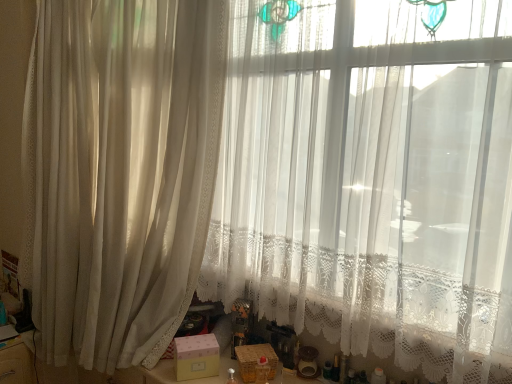
Question: From a real-world perspective, is pink matte box at center, the 2th box when ordered from right to left, located beneath wooden basket at lower center, marked as the 2th box in a left-to-right arrangement?

Choices:
 (A) no
 (B) yes

Answer: (A)

Question: Can wooden basket at lower center, marked as the 2th box in a left-to-right arrangement, be found inside pink matte box at center, the 2th box when ordered from right to left?

Choices:
 (A) yes
 (B) no

Answer: (B)

Question: Does pink matte box at center, the 2th box when ordered from right to left, have a smaller size compared to wooden basket at lower center, which appears as the first box when viewed from the right?

Choices:
 (A) no
 (B) yes

Answer: (A)

Question: From the image's perspective, would you say pink matte box at center, the first box in the left-to-right sequence, is positioned over wooden basket at lower center, marked as the 2th box in a left-to-right arrangement?

Choices:
 (A) no
 (B) yes

Answer: (B)

Question: Is pink matte box at center, the first box in the left-to-right sequence, wider than wooden basket at lower center, marked as the 2th box in a left-to-right arrangement?

Choices:
 (A) no
 (B) yes

Answer: (B)

Question: From a real-world perspective, relative to wooden basket at lower center, which appears as the first box when viewed from the right, is sheer white curtain at left vertically above or below?

Choices:
 (A) below
 (B) above

Answer: (B)

Question: In terms of width, does sheer white curtain at left look wider or thinner when compared to wooden basket at lower center, which appears as the first box when viewed from the right?

Choices:
 (A) thin
 (B) wide

Answer: (B)

Question: In terms of height, does sheer white curtain at left look taller or shorter compared to wooden basket at lower center, which appears as the first box when viewed from the right?

Choices:
 (A) tall
 (B) short

Answer: (A)

Question: Based on their sizes in the image, would you say sheer white curtain at left is bigger or smaller than wooden basket at lower center, marked as the 2th box in a left-to-right arrangement?

Choices:
 (A) big
 (B) small

Answer: (A)

Question: Is point (178, 377) closer or farther from the camera than point (41, 241)?

Choices:
 (A) farther
 (B) closer

Answer: (B)

Question: From the image's perspective, is pink matte box at center, the first box in the left-to-right sequence, positioned above or below sheer white curtain at left?

Choices:
 (A) above
 (B) below

Answer: (B)

Question: Is pink matte box at center, the 2th box when ordered from right to left, bigger or smaller than sheer white curtain at left?

Choices:
 (A) big
 (B) small

Answer: (B)

Question: Relative to sheer white curtain at left, is pink matte box at center, the 2th box when ordered from right to left, in front or behind?

Choices:
 (A) behind
 (B) front

Answer: (A)

Question: From the image's perspective, relative to sheer white curtain at left, is wooden basket at lower center, marked as the 2th box in a left-to-right arrangement, above or below?

Choices:
 (A) above
 (B) below

Answer: (B)

Question: From a real-world perspective, is wooden basket at lower center, which appears as the first box when viewed from the right, above or below sheer white curtain at left?

Choices:
 (A) below
 (B) above

Answer: (A)